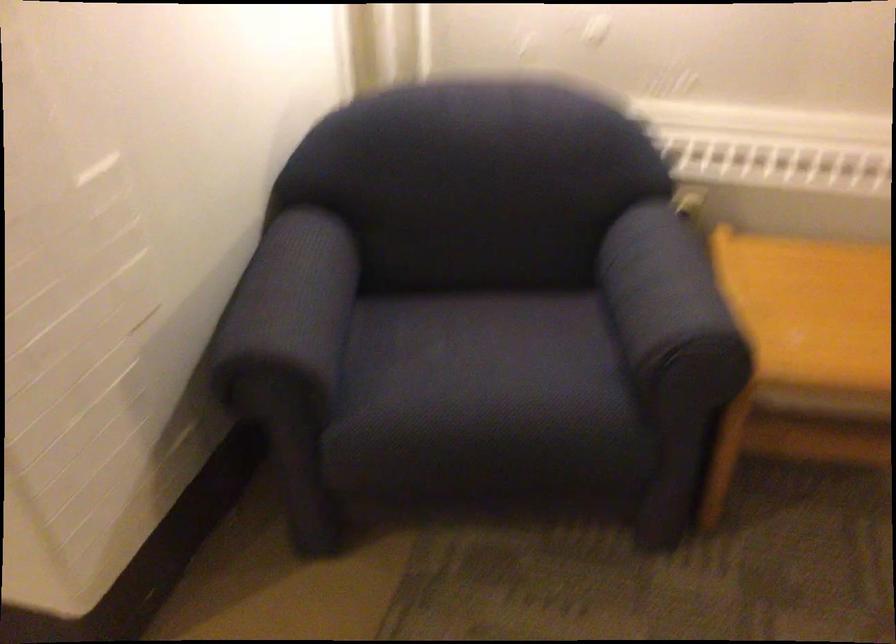
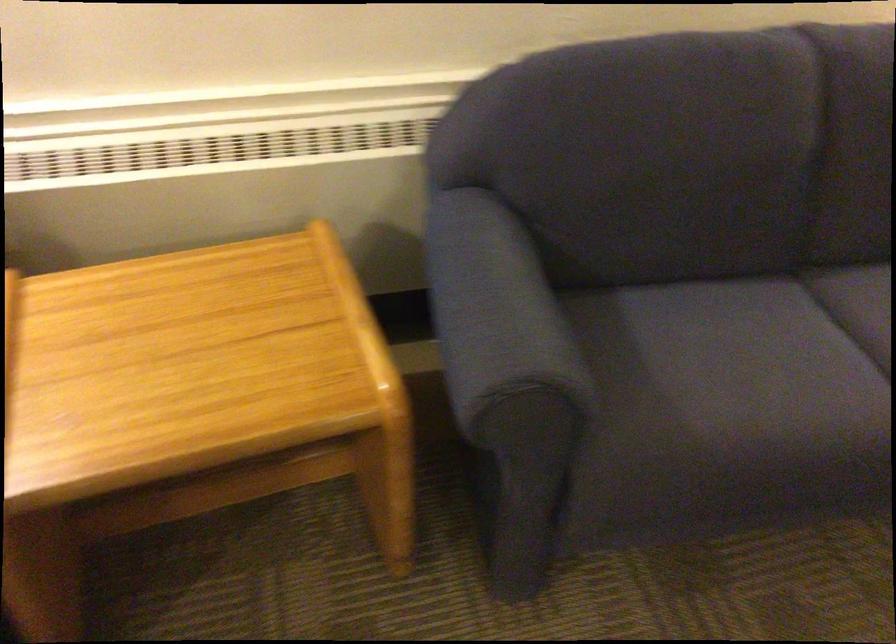
Question: Based on the continuous images, in which direction is the camera rotating? Reply with the corresponding letter.

Choices:
 (A) Left
 (B) Right
 (C) Up
 (D) Down

Answer: (B)